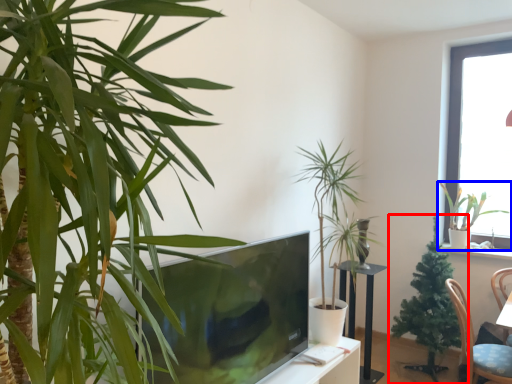
Question: Which object appears farthest to the camera in this image, houseplant (highlighted by a red box) or houseplant (highlighted by a blue box)?

Choices:
 (A) houseplant
 (B) houseplant

Answer: (B)